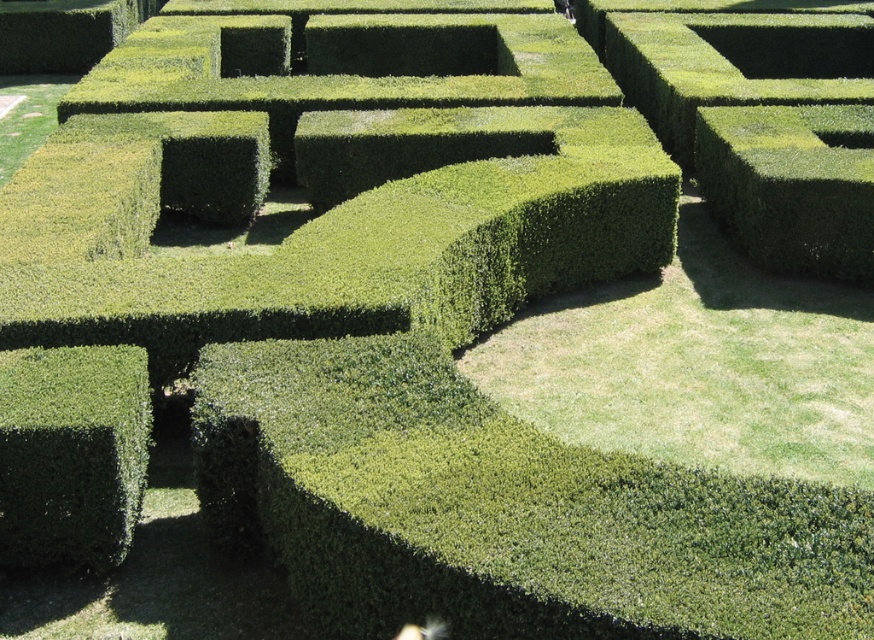
You are navigating through a hedge maze and see two hedges ahead of you. One is the green textured hedge at lower left and the other is the green textured hedge at upper right. Which hedge would you choose to walk around if you want to take the shorter path?

The green textured hedge at lower left occupies less space than the green textured hedge at upper right, so you should walk around the green textured hedge at lower left to take the shorter path.

You are a drone operator tasked with capturing aerial footage of the hedge maze. Your drone has a maximum flight range of 9 meters from its starting position. If you take off from the green textured hedge at lower left, will you be able to reach the green textured hedge at upper right without exceeding the drone range limit?

The distance between the green textured hedge at lower left and the green textured hedge at upper right is 8.82 meters, which is within the drone operator drone range limit of 9 meters. Therefore, the drone can reach the green textured hedge at upper right without exceeding its maximum flight range.